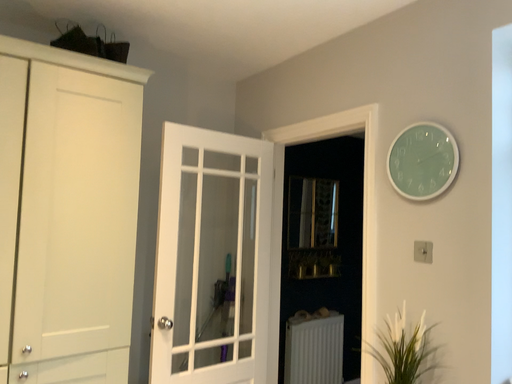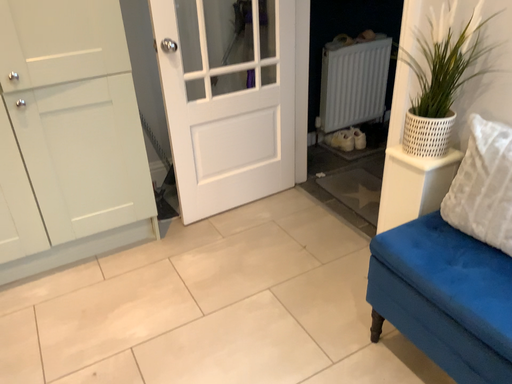
Question: Which way did the camera rotate in the video?

Choices:
 (A) rotated upward
 (B) rotated downward

Answer: (B)